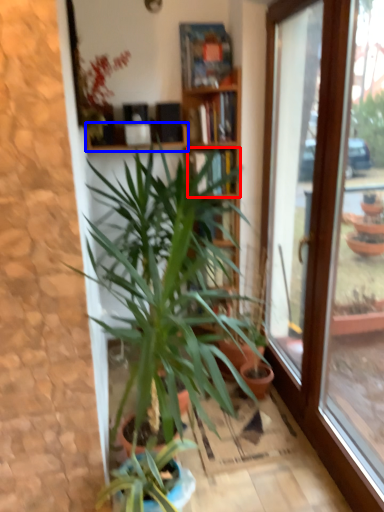
Question: Which point is closer to the camera, shelf (highlighted by a red box) or shelf (highlighted by a blue box)?

Choices:
 (A) shelf
 (B) shelf

Answer: (B)